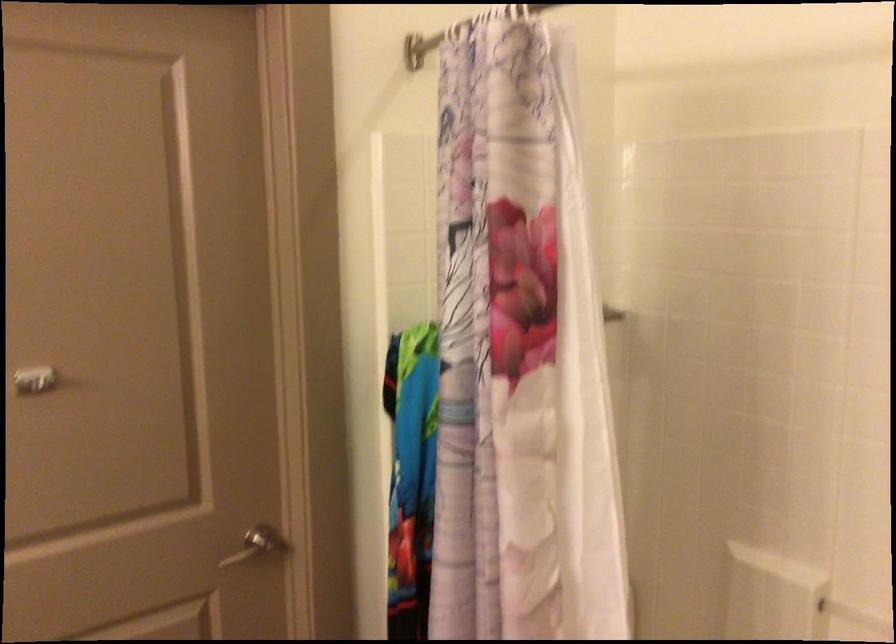
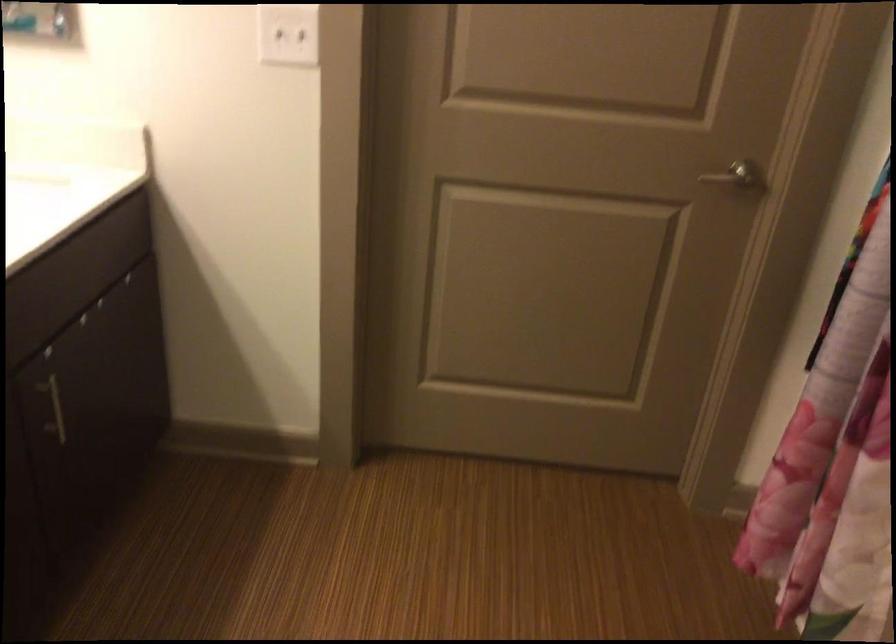
In the second image, find the point that corresponds to pixel 261 549 in the first image.

(739, 178)